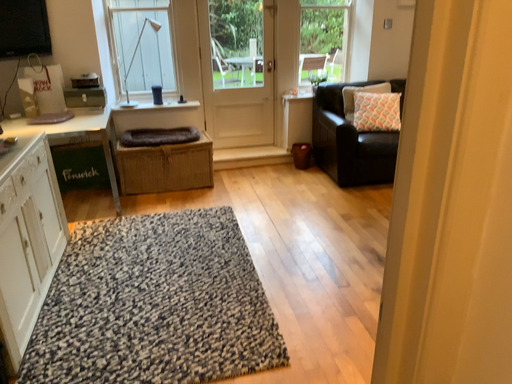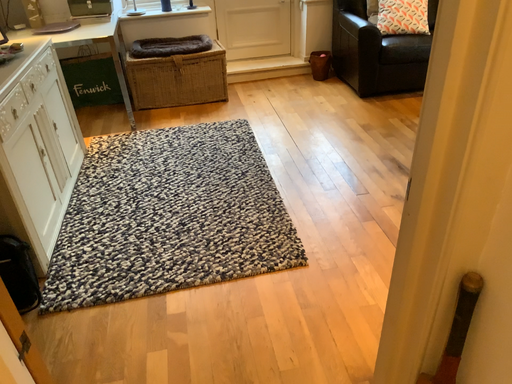
Question: How did the camera likely rotate when shooting the video?

Choices:
 (A) rotated downward
 (B) rotated upward

Answer: (A)